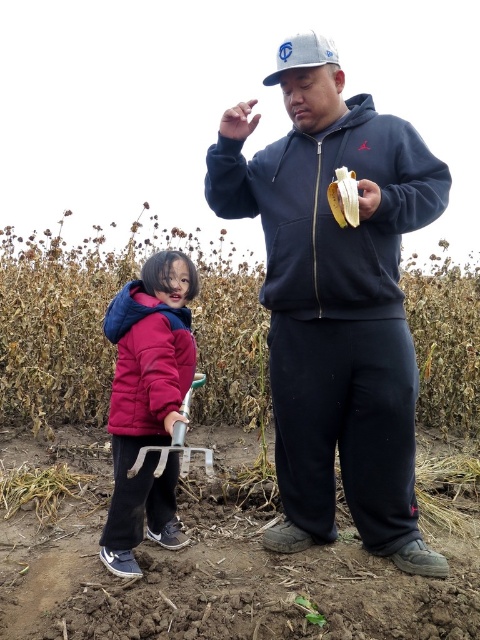
You are standing at the point marked as point (213, 573). What is the material under your feet?

The material under your feet at point (213, 573) is brown soil at center.

You are a photographer trying to capture the velvet maroon jacket at lower left in your shot. If your camera has a rectangular viewfinder that can only focus on objects within a 0.5x0.5 area centered at the point you choose, what is the best center point to ensure the jacket is fully visible?

The best center point would be the coordinates of the velvet maroon jacket at lower left, which is at point (147, 403). By centering the viewfinder there, the 0.5x0.5 area will encompass the jacket as it is precisely located at that coordinate.